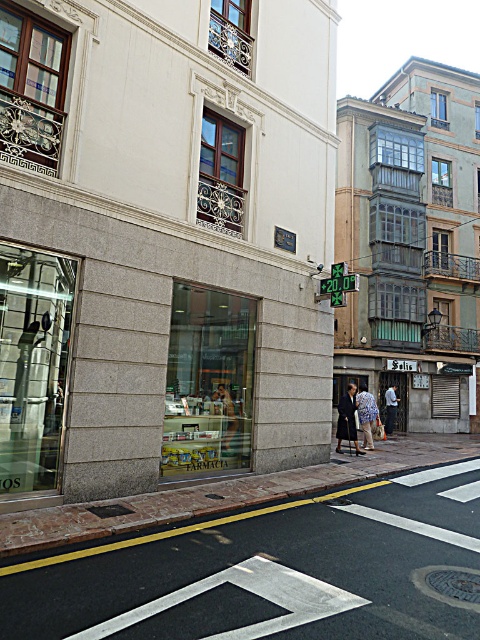
Question: Which object is farther from the camera taking this photo?

Choices:
 (A) smooth concrete pavement at center
 (B) dark blue jeans at center

Answer: (B)

Question: Among these points, which one is nearest to the camera?

Choices:
 (A) (394, 420)
 (B) (324, 253)
 (C) (365, 428)
 (D) (220, 580)

Answer: (D)

Question: Is smooth concrete pavement at center to the right of dark gray coat at center from the viewer's perspective?

Choices:
 (A) no
 (B) yes

Answer: (A)

Question: Can you confirm if smooth concrete pavement at center is positioned to the left of dark gray coat at center?

Choices:
 (A) no
 (B) yes

Answer: (B)

Question: Which object is closer to the camera taking this photo?

Choices:
 (A) dark blue jeans at center
 (B) blue floral dress at center
 (C) dark gray coat at center
 (D) granite storefront at center

Answer: (D)

Question: Is dark gray coat at center positioned in front of dark blue jeans at center?

Choices:
 (A) yes
 (B) no

Answer: (A)